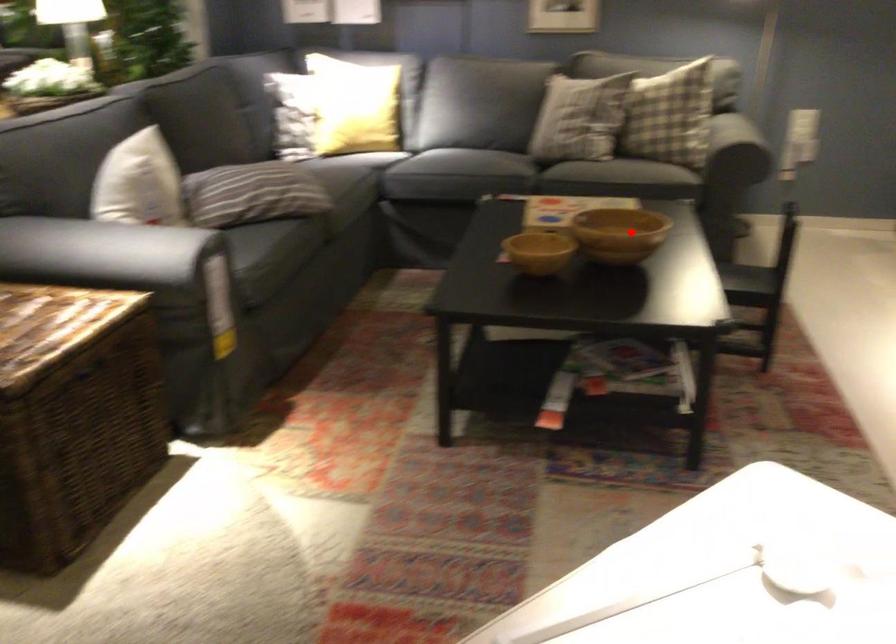
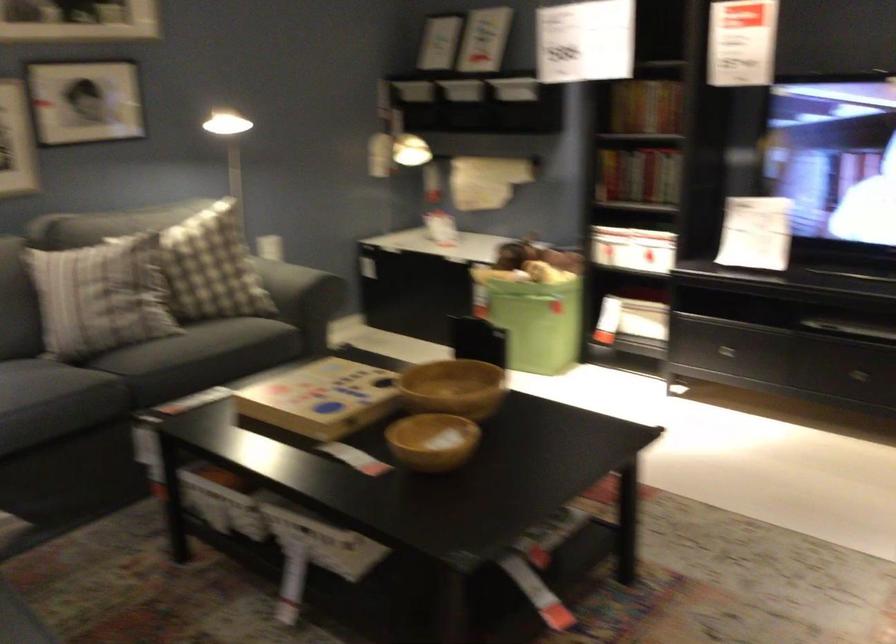
Locate, in the second image, the point that corresponds to the highlighted location in the first image.

(453, 388)